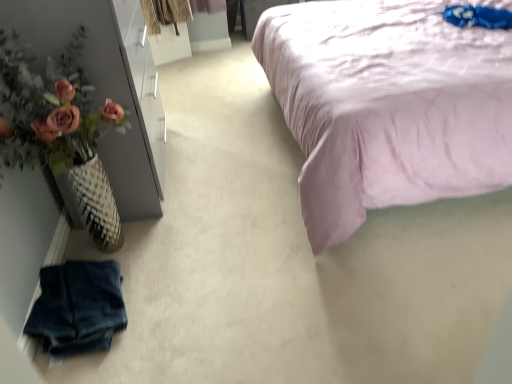
Question: Is lavender satin bed at upper right facing away from faded denim shorts at lower left?

Choices:
 (A) no
 (B) yes

Answer: (A)

Question: Is lavender satin bed at upper right smaller than faded denim shorts at lower left?

Choices:
 (A) no
 (B) yes

Answer: (A)

Question: Is lavender satin bed at upper right directly adjacent to faded denim shorts at lower left?

Choices:
 (A) yes
 (B) no

Answer: (B)

Question: Would you consider lavender satin bed at upper right to be distant from faded denim shorts at lower left?

Choices:
 (A) yes
 (B) no

Answer: (A)

Question: Can you confirm if lavender satin bed at upper right is positioned to the left of faded denim shorts at lower left?

Choices:
 (A) no
 (B) yes

Answer: (A)

Question: Considering the relative sizes of lavender satin bed at upper right and faded denim shorts at lower left in the image provided, is lavender satin bed at upper right wider than faded denim shorts at lower left?

Choices:
 (A) no
 (B) yes

Answer: (B)

Question: Considering the relative sizes of faded denim shorts at lower left and lavender satin bed at upper right in the image provided, is faded denim shorts at lower left taller than lavender satin bed at upper right?

Choices:
 (A) no
 (B) yes

Answer: (A)

Question: Are faded denim shorts at lower left and lavender satin bed at upper right making contact?

Choices:
 (A) no
 (B) yes

Answer: (A)

Question: Could lavender satin bed at upper right be considered to be inside faded denim shorts at lower left?

Choices:
 (A) no
 (B) yes

Answer: (A)

Question: Does faded denim shorts at lower left have a larger size compared to lavender satin bed at upper right?

Choices:
 (A) yes
 (B) no

Answer: (B)

Question: From a real-world perspective, is faded denim shorts at lower left on lavender satin bed at upper right?

Choices:
 (A) yes
 (B) no

Answer: (B)

Question: Is faded denim shorts at lower left closer to the viewer compared to lavender satin bed at upper right?

Choices:
 (A) no
 (B) yes

Answer: (A)

Question: Is faded denim shorts at lower left looking in the opposite direction of matte pink flowers at left?

Choices:
 (A) no
 (B) yes

Answer: (A)